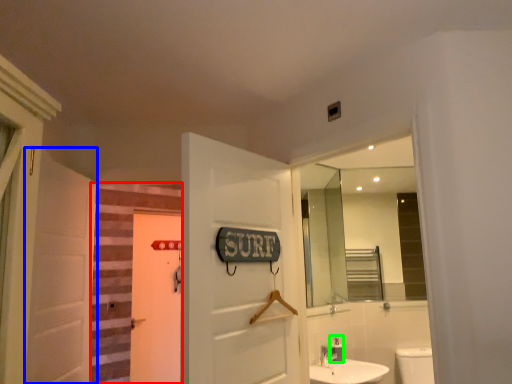
Question: Which object is the farthest from stairwell (highlighted by a red box)? Choose among these: door (highlighted by a blue box) or toiletry (highlighted by a green box).

Choices:
 (A) door
 (B) toiletry

Answer: (B)